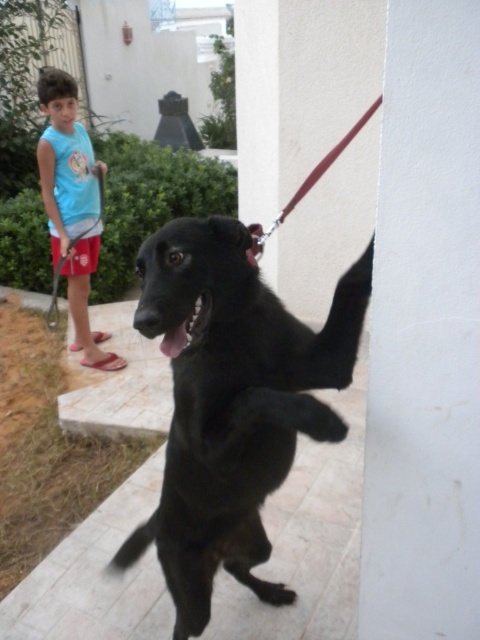
You are a photographer trying to capture a closeup of the shiny black dog at center. However, the red leather leash at upper center is blocking your view. Can you move the leash to the side to get a clear shot?

The shiny black dog at center is closer to the viewer than the red leather leash at upper center, so you can move the leash to the side to get a clear shot.

You are a photographer trying to capture a photo of the shiny black dog at center and the light blue sleeveless shirt at upper left. From your current position, which object is positioned lower?

The shiny black dog at center is positioned below the light blue sleeveless shirt at upper left, so the shiny black dog at center is lower.

You are a photographer trying to capture the perfect shot of the shiny black dog at center. You notice that the dog is exactly at point [231,403]. If your camera frame is set to focus on the center point of the image, which is at 0.5, 0.5, will the dog be slightly to the left or right of the center?

The dog is at point [231,403], which is to the right of the center point 0.5, 0.5, so the dog will be slightly to the right of the center.